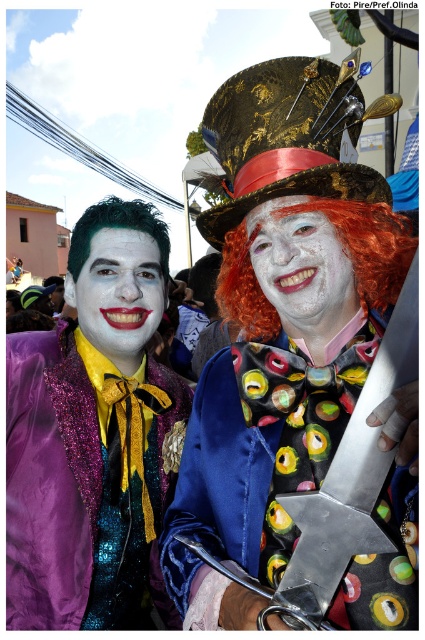
Which of these two, sparkly purple jacket at left or fluffy orange wig at center, stands taller?

With more height is sparkly purple jacket at left.

Is point (25, 481) in front of point (413, 253)?

No, it is not.

Describe the element at coordinates (40, 497) in the screenshot. The width and height of the screenshot is (425, 640). I see `sparkly purple jacket at left` at that location.

I want to click on sparkly purple jacket at left, so click(x=40, y=497).

Between black satin bow tie at center and fluffy orange wig at center, which one has less height?

With less height is fluffy orange wig at center.

In the scene shown: Between black satin bow tie at center and fluffy orange wig at center, which one is positioned higher?

Positioned higher is fluffy orange wig at center.

Which is in front, point (215, 364) or point (367, 221)?

Positioned in front is point (367, 221).

In order to click on black satin bow tie at center in this screenshot , I will do `click(218, 483)`.

Consider the image. Between sparkly purple jacket at left and matte black face at center, which one is positioned lower?

sparkly purple jacket at left is lower down.

Looking at this image, which of these two, sparkly purple jacket at left or matte black face at center, stands taller?

With more height is sparkly purple jacket at left.

In order to click on sparkly purple jacket at left in this screenshot , I will do `click(40, 497)`.

Locate an element on the screen. The image size is (425, 640). sparkly purple jacket at left is located at coordinates (40, 497).